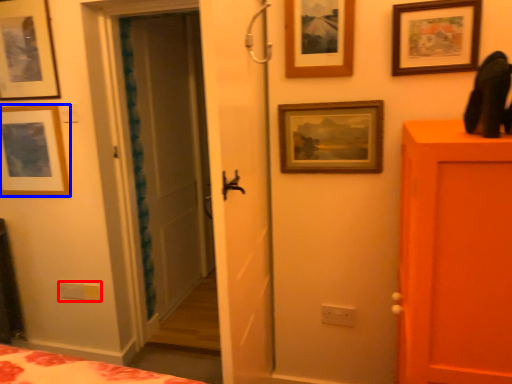
Question: Which point is further to the camera, light switch (highlighted by a red box) or picture frame (highlighted by a blue box)?

Choices:
 (A) light switch
 (B) picture frame

Answer: (A)